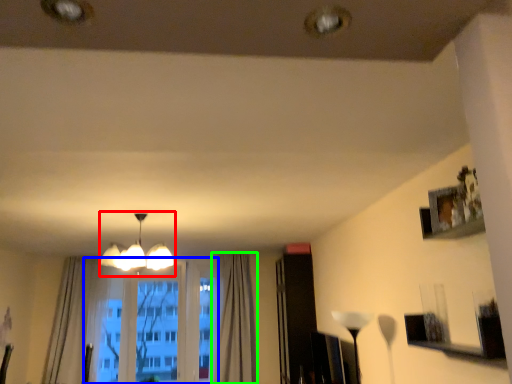
Question: Which object is the farthest from lamp (highlighted by a red box)? Choose among these: bay window (highlighted by a blue box) or curtain (highlighted by a green box).

Choices:
 (A) bay window
 (B) curtain

Answer: (A)